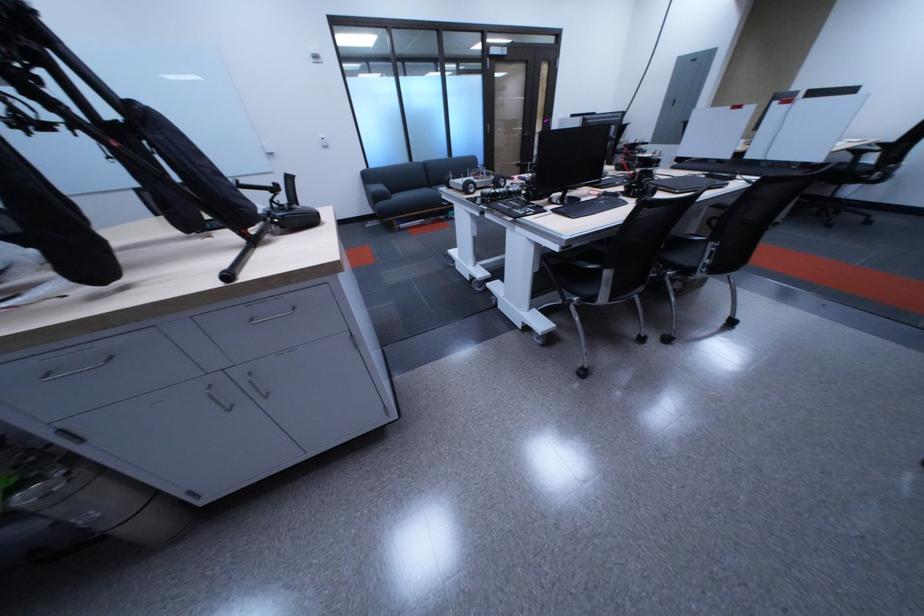
Where is `sofa armrest`? This screenshot has width=924, height=616. sofa armrest is located at coordinates [377, 192].